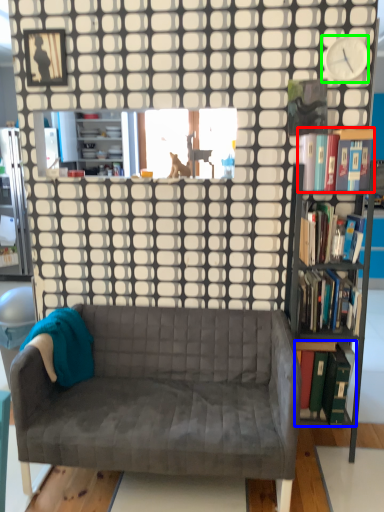
Question: Which object is the farthest from book (highlighted by a red box)? Choose among these: book (highlighted by a blue box) or clock (highlighted by a green box).

Choices:
 (A) book
 (B) clock

Answer: (A)